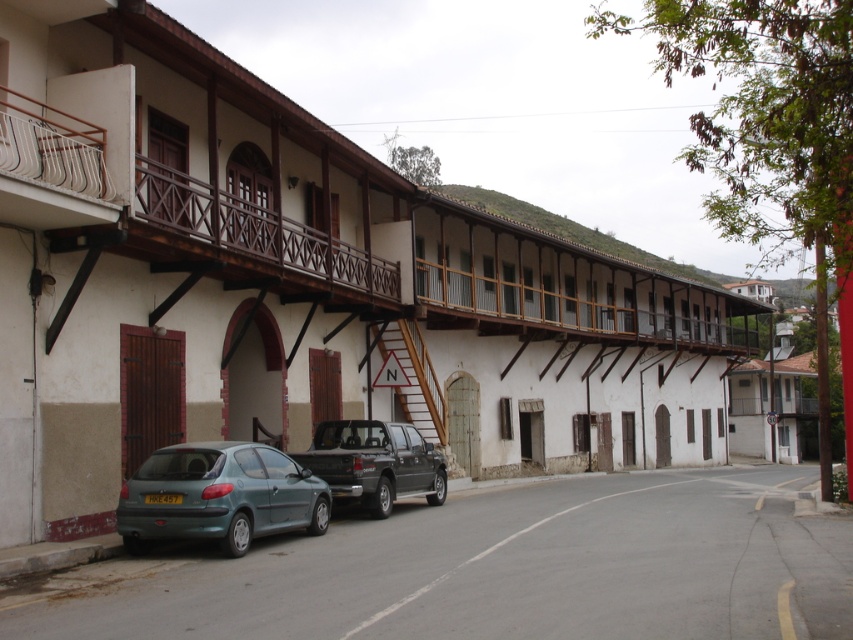
Question: Is teal matte hatchback at lower left bigger than dark gray matte truck at center?

Choices:
 (A) no
 (B) yes

Answer: (A)

Question: Is white wooden balcony at upper left smaller than dark gray matte truck at center?

Choices:
 (A) no
 (B) yes

Answer: (B)

Question: Among these points, which one is farthest from the camera?

Choices:
 (A) (381, 324)
 (B) (361, 483)
 (C) (155, 481)
 (D) (0, 109)

Answer: (A)

Question: Which object is farther from the camera taking this photo?

Choices:
 (A) white wooden balcony at upper left
 (B) teal matte hatchback at lower left
 (C) wooden staircase at center
 (D) dark gray matte truck at center

Answer: (C)

Question: Does teal matte hatchback at lower left have a smaller size compared to dark gray matte truck at center?

Choices:
 (A) no
 (B) yes

Answer: (B)

Question: Which point is farther to the camera?

Choices:
 (A) dark gray matte truck at center
 (B) white wooden balcony at upper left
 (C) wooden staircase at center
 (D) teal matte hatchback at lower left

Answer: (C)